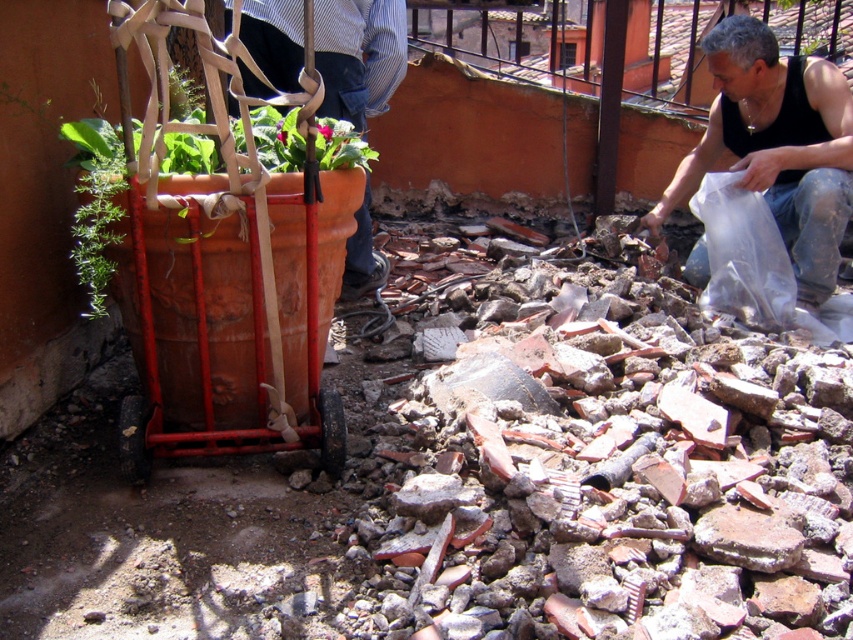
You are a construction worker standing at the center of the scene. You need to move the terracotta clay cart at left to the right side of the broken tiles and debris pile. Can you reach the cart from your current position without stepping on the debris?

The terracotta clay cart at left is positioned at point (225, 259), so yes, you can reach it without stepping on the debris as it is located to the left side of the scene away from the central debris pile.

You are a construction worker who needs to move the terracotta clay cart at left and the black tank top at lower right to a storage area. If you want to stack them, which one should be placed at the bottom to support the other?

The terracotta clay cart at left has a smaller size compared to black tank top at lower right, so the black tank top at lower right should be placed at the bottom to support the terracotta clay cart at left.

Looking at this image, you are a worker who needs to reach the striped shirt at upper center from the terracotta clay cart at left. Can you safely walk directly to it without stepping on the broken tiles and debris in the foreground?

The distance between the terracotta clay cart at left and the striped shirt at upper center is 1.26 meters. Since the path is clear of obstacles except for the broken tiles and debris in the foreground, you would need to navigate around them. However, the question specifies walking directly, so stepping on the debris might be unavoidable. Therefore, it is not safe to walk directly without stepping on the broken tiles and debris.